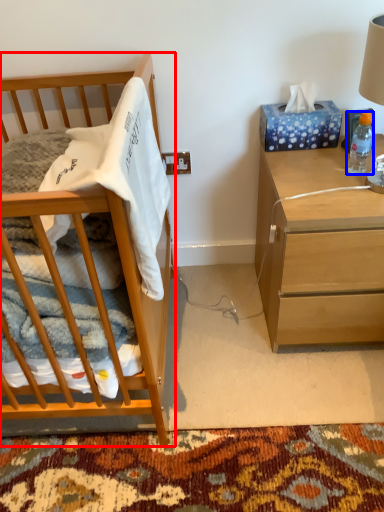
Question: Among these objects, which one is farthest to the camera, cabinetry (highlighted by a red box) or bottle (highlighted by a blue box)?

Choices:
 (A) cabinetry
 (B) bottle

Answer: (B)